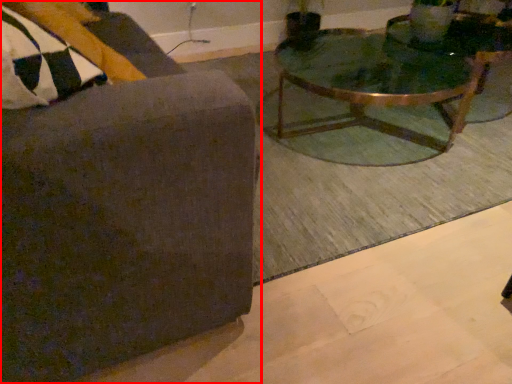
Question: From the image's perspective, what is the correct spatial positioning of chair (annotated by the red box) in reference to coffee table?

Choices:
 (A) below
 (B) above

Answer: (A)